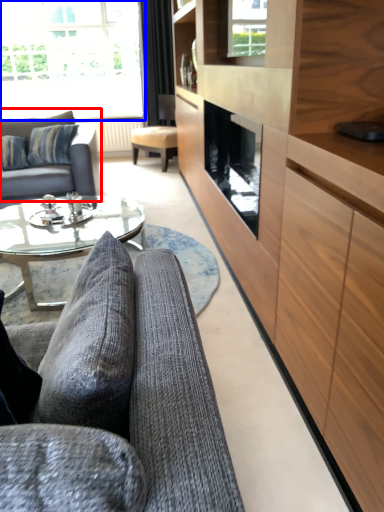
Question: Among these objects, which one is nearest to the camera, studio couch (highlighted by a red box) or window (highlighted by a blue box)?

Choices:
 (A) studio couch
 (B) window

Answer: (A)